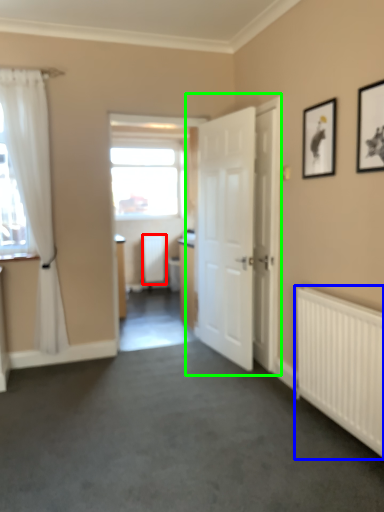
Question: Estimate the real-world distances between objects in this image. Which object is closer to radiator (highlighted by a red box), radiator (highlighted by a blue box) or door (highlighted by a green box)?

Choices:
 (A) radiator
 (B) door

Answer: (B)